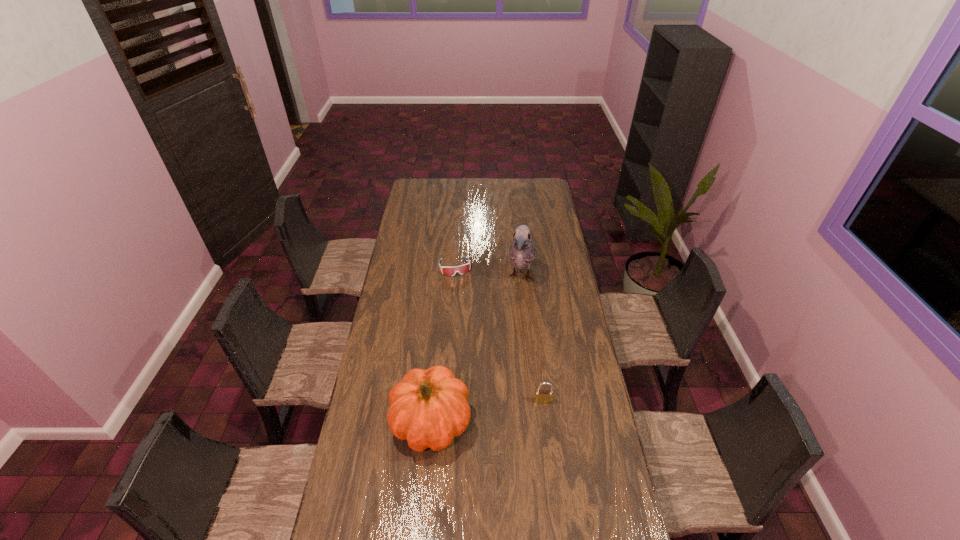
Locate an element on the screen. free spot between the shortest object and the tallest object is located at coordinates click(488, 272).

In order to click on vacant space in between the pumpkin and the padlock in this screenshot , I will do `click(488, 411)`.

Find the location of `unoccupied position between the parrot and the padlock`. unoccupied position between the parrot and the padlock is located at coordinates (532, 339).

At what (x,y) coordinates should I click in order to perform the action: click on empty space that is in between the parrot and the second shortest object. Please return your answer as a coordinate pair (x, y). Looking at the image, I should click on (532, 339).

I want to click on free point between the pumpkin and the tallest object, so click(476, 350).

Image resolution: width=960 pixels, height=540 pixels. I want to click on vacant space that is in between the third tallest object and the parrot, so click(x=532, y=339).

Where is `free area in between the parrot and the third shortest object`? free area in between the parrot and the third shortest object is located at coordinates (476, 350).

Find the location of a particular element. The height and width of the screenshot is (540, 960). vacant area that lies between the pumpkin and the shortest object is located at coordinates [x=444, y=345].

At what (x,y) coordinates should I click in order to perform the action: click on object identified as the closest to the goggles. Please return your answer as a coordinate pair (x, y). Looking at the image, I should click on (522, 250).

Find the location of `the closest object to the shortest object`. the closest object to the shortest object is located at coordinates (522, 250).